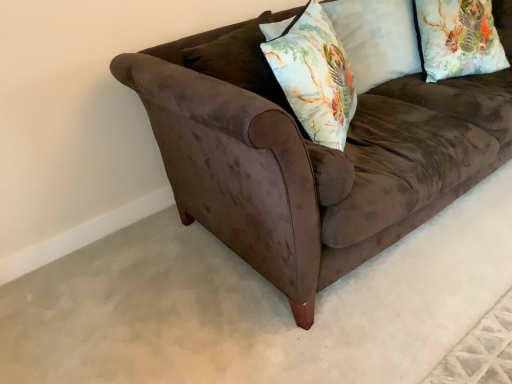
Question: Is there a large distance between floral fabric pillow at upper right, the 2th pillow when ordered from left to right, and floral fabric pillow at upper right, which is the 1th pillow in left-to-right order?

Choices:
 (A) no
 (B) yes

Answer: (A)

Question: Does floral fabric pillow at upper right, placed as the 1th pillow when sorted from right to left, appear on the left side of floral fabric pillow at upper right, which is the 1th pillow in left-to-right order?

Choices:
 (A) yes
 (B) no

Answer: (B)

Question: Considering the relative sizes of floral fabric pillow at upper right, placed as the 1th pillow when sorted from right to left, and floral fabric pillow at upper right, arranged as the 2th pillow when viewed from the right, in the image provided, is floral fabric pillow at upper right, placed as the 1th pillow when sorted from right to left, thinner than floral fabric pillow at upper right, arranged as the 2th pillow when viewed from the right,?

Choices:
 (A) no
 (B) yes

Answer: (A)

Question: Does floral fabric pillow at upper right, the 2th pillow when ordered from left to right, come behind floral fabric pillow at upper right, which is the 1th pillow in left-to-right order?

Choices:
 (A) no
 (B) yes

Answer: (A)

Question: From the image's perspective, would you say floral fabric pillow at upper right, the 2th pillow when ordered from left to right, is shown under floral fabric pillow at upper right, which is the 1th pillow in left-to-right order?

Choices:
 (A) yes
 (B) no

Answer: (B)

Question: Is floral fabric pillow at upper right, placed as the 1th pillow when sorted from right to left, to the right of floral fabric pillow at upper right, arranged as the 2th pillow when viewed from the right, from the viewer's perspective?

Choices:
 (A) yes
 (B) no

Answer: (A)

Question: Can you confirm if floral fabric pillow at center is shorter than brown velvet couch at center?

Choices:
 (A) no
 (B) yes

Answer: (B)

Question: Considering the relative sizes of floral fabric pillow at center and brown velvet couch at center in the image provided, is floral fabric pillow at center thinner than brown velvet couch at center?

Choices:
 (A) no
 (B) yes

Answer: (B)

Question: Is floral fabric pillow at center smaller than brown velvet couch at center?

Choices:
 (A) yes
 (B) no

Answer: (A)

Question: Does floral fabric pillow at center have a larger size compared to brown velvet couch at center?

Choices:
 (A) no
 (B) yes

Answer: (A)

Question: Is floral fabric pillow at center not close to brown velvet couch at center?

Choices:
 (A) no
 (B) yes

Answer: (A)

Question: Does floral fabric pillow at center turn towards brown velvet couch at center?

Choices:
 (A) yes
 (B) no

Answer: (A)

Question: From the image's perspective, does floral fabric pillow at upper right, the 2th pillow when ordered from left to right, appear higher than brown velvet couch at center?

Choices:
 (A) yes
 (B) no

Answer: (A)